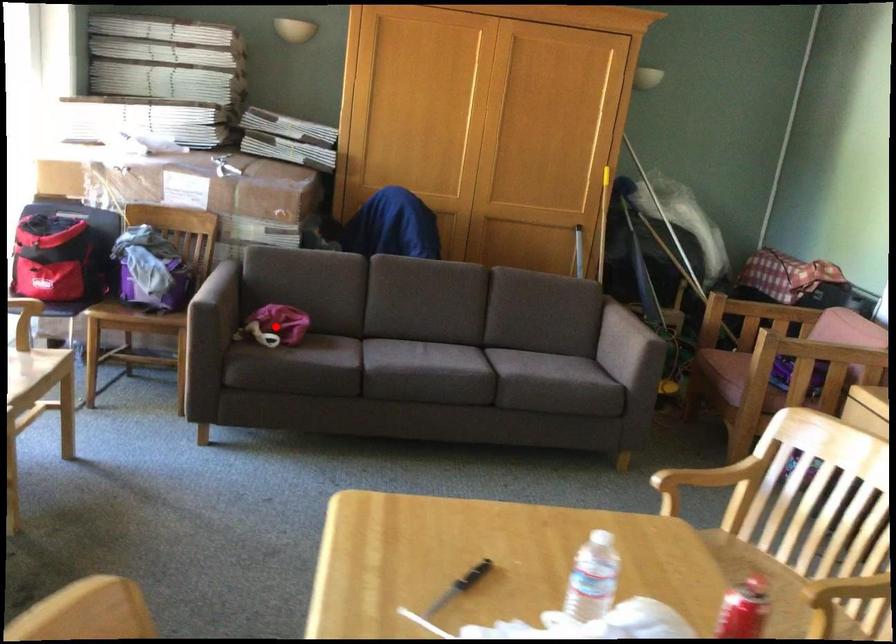
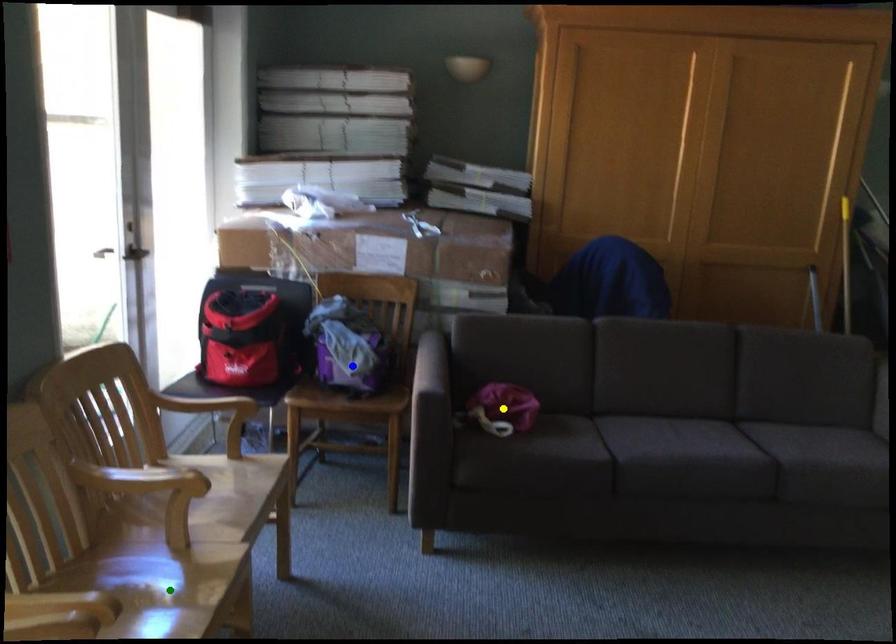
Question: I am providing you with two images of the same scene from different viewpoints. A red point is marked on the first image. You are given multiple points on the second image. Which point in image 2 is actually the same real-world point as the red point in image 1?

Choices:
 (A) blue point
 (B) yellow point
 (C) green point

Answer: (B)